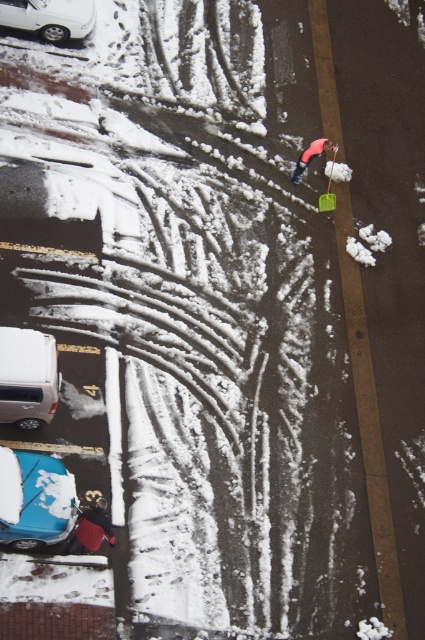
Which is behind, point (93, 19) or point (93, 541)?

Positioned behind is point (93, 19).

Is white glossy car at upper left positioned behind red fabric bag at lower left?

That is True.

Is point (53, 10) closer to viewer compared to point (68, 550)?

No, it is behind (68, 550).

The width and height of the screenshot is (425, 640). In order to click on white glossy car at upper left in this screenshot , I will do `click(50, 17)`.

Is point (25, 413) positioned behind point (44, 32)?

No, (25, 413) is in front of (44, 32).

Measure the distance between white matte van at lower left and camera.

white matte van at lower left is 51.07 feet away from camera.

You are a GUI agent. You are given a task and a screenshot of the screen. Output one action in this format:
    pyautogui.click(x=<x>, y=<y>)
    Task: Click on the white matte van at lower left
    
    Given the screenshot: What is the action you would take?
    point(28,378)

Which is above, white glossy car at upper left or red fabric umbrella at upper center?

Positioned higher is white glossy car at upper left.

Describe the element at coordinates (50, 17) in the screenshot. I see `white glossy car at upper left` at that location.

Does point (0, 4) come farther from viewer compared to point (320, 147)?

No, it is not.

You are a GUI agent. You are given a task and a screenshot of the screen. Output one action in this format:
    pyautogui.click(x=<x>, y=<y>)
    Task: Click on the white glossy car at upper left
    
    Given the screenshot: What is the action you would take?
    pyautogui.click(x=50, y=17)